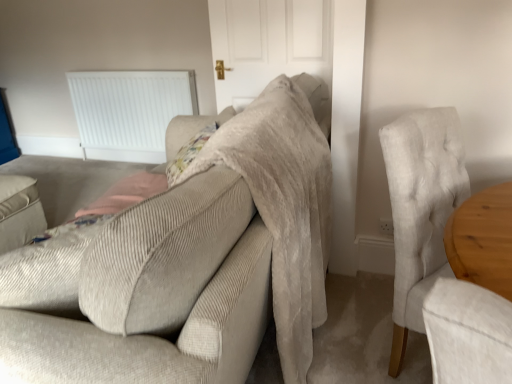
Question: Is light gray fabric chair at right closer to the viewer compared to white plastic radiator at upper left?

Choices:
 (A) no
 (B) yes

Answer: (B)

Question: Is light gray fabric chair at right in contact with white plastic radiator at upper left?

Choices:
 (A) yes
 (B) no

Answer: (B)

Question: Is light gray fabric chair at right facing away from white plastic radiator at upper left?

Choices:
 (A) no
 (B) yes

Answer: (B)

Question: From a real-world perspective, is light gray fabric chair at right beneath white plastic radiator at upper left?

Choices:
 (A) yes
 (B) no

Answer: (B)

Question: Can you confirm if light gray fabric chair at right is smaller than white plastic radiator at upper left?

Choices:
 (A) no
 (B) yes

Answer: (A)

Question: Can you confirm if light gray fabric chair at right is positioned to the right of white plastic radiator at upper left?

Choices:
 (A) no
 (B) yes

Answer: (B)

Question: Is beige corduroy couch at center wider than white plastic radiator at upper left?

Choices:
 (A) no
 (B) yes

Answer: (B)

Question: Does beige corduroy couch at center contain white plastic radiator at upper left?

Choices:
 (A) no
 (B) yes

Answer: (A)

Question: From a real-world perspective, does beige corduroy couch at center stand above white plastic radiator at upper left?

Choices:
 (A) no
 (B) yes

Answer: (B)

Question: Considering the relative sizes of beige corduroy couch at center and white plastic radiator at upper left in the image provided, is beige corduroy couch at center smaller than white plastic radiator at upper left?

Choices:
 (A) yes
 (B) no

Answer: (B)

Question: From the image's perspective, is beige corduroy couch at center under white plastic radiator at upper left?

Choices:
 (A) yes
 (B) no

Answer: (A)

Question: Is beige corduroy couch at center looking in the opposite direction of white plastic radiator at upper left?

Choices:
 (A) no
 (B) yes

Answer: (A)

Question: From a real-world perspective, is white matte door at center over light gray fabric chair at right?

Choices:
 (A) yes
 (B) no

Answer: (A)